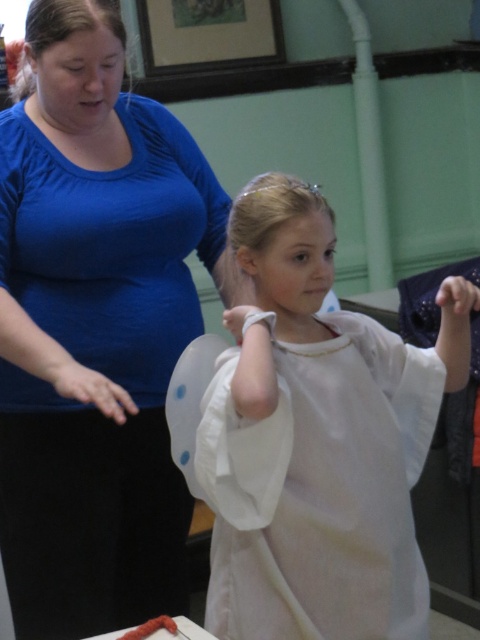
Image resolution: width=480 pixels, height=640 pixels. In order to click on blue matte shirt at upper left in this screenshot , I will do `click(95, 328)`.